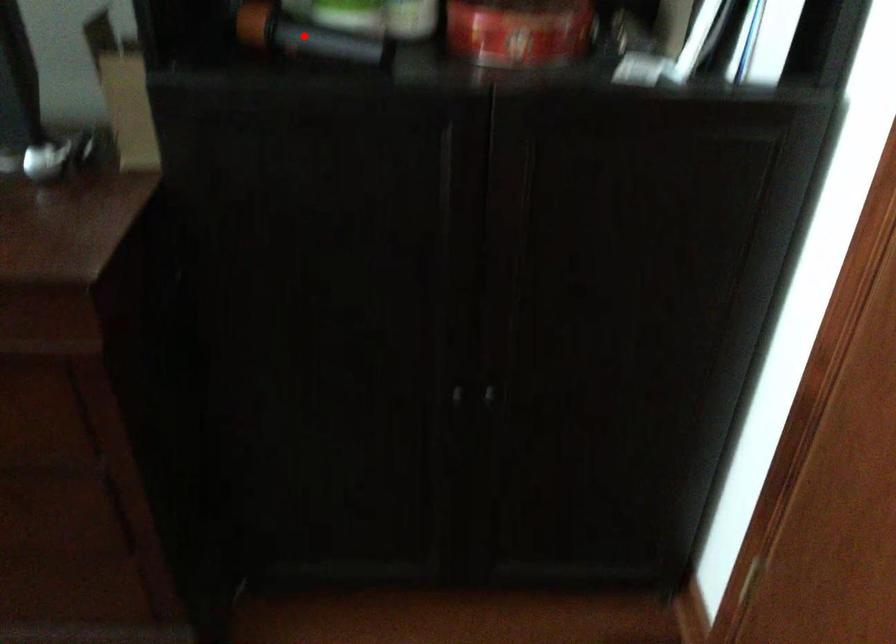
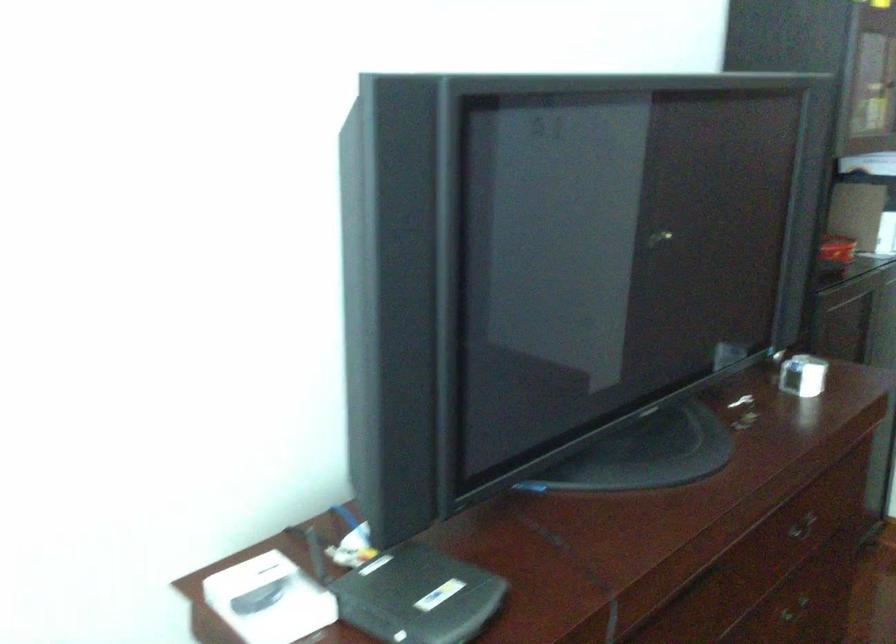
Question: I am providing you with two images of the same scene from different viewpoints. A red point is marked on the first image. Can you still see the location of the red point in image 2?

Choices:
 (A) Yes
 (B) No

Answer: (B)